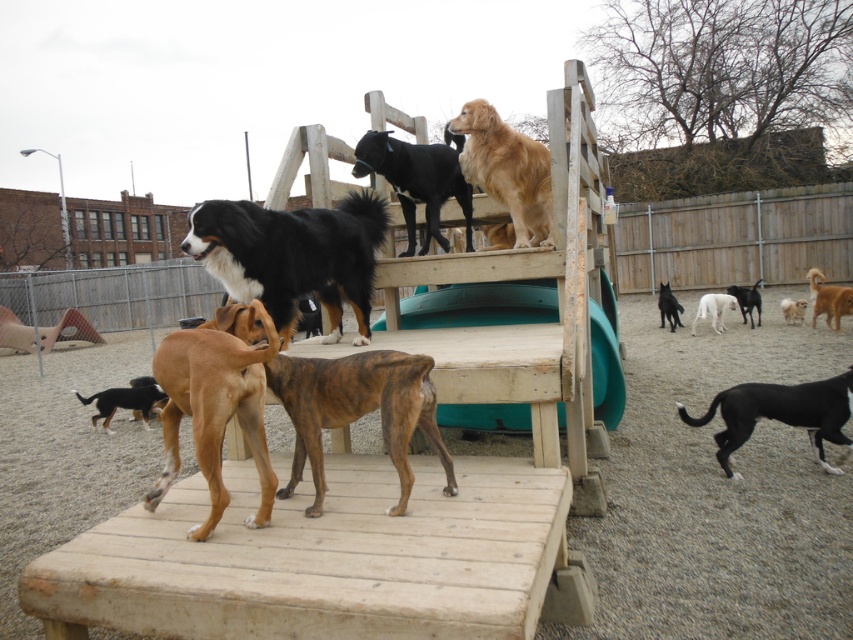
Does golden fur dog at upper center come in front of black and tan fur at lower left?

Yes, it is.

Which is behind, point (527, 234) or point (148, 394)?

The point (148, 394) is more distant.

The image size is (853, 640). Find the location of `golden fur dog at upper center`. golden fur dog at upper center is located at coordinates (508, 170).

Based on the photo, is wooden fence at right below white fur dog at lower right?

No.

This screenshot has height=640, width=853. In order to click on wooden fence at right in this screenshot , I will do `click(734, 237)`.

Where is `wooden fence at right`? The width and height of the screenshot is (853, 640). wooden fence at right is located at coordinates (734, 237).

Is the position of wooden fence at right more distant than that of brown brindle dog at center?

Yes, it is behind brown brindle dog at center.

Which is in front, point (845, 209) or point (155, 481)?

Point (155, 481)

Find the location of a particular element. wooden fence at right is located at coordinates (734, 237).